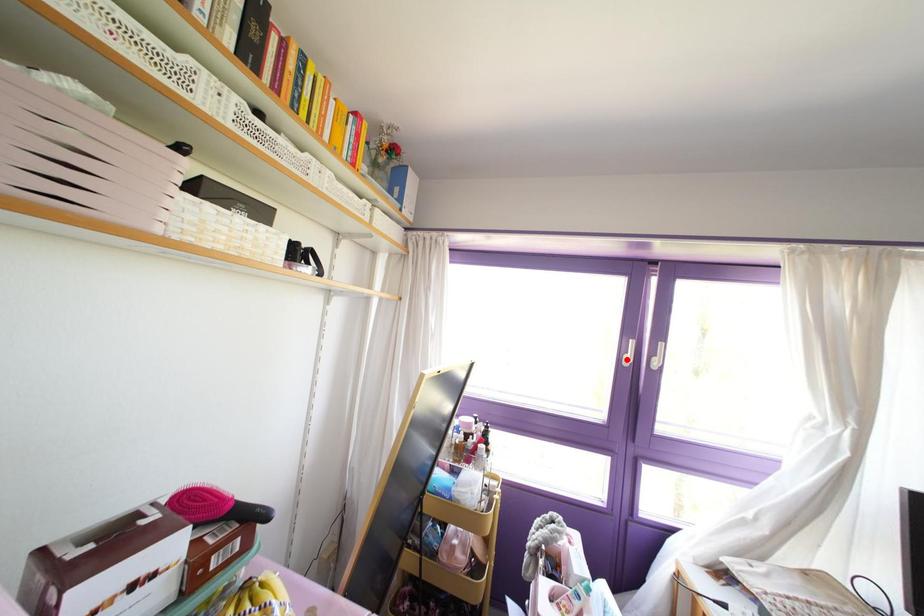
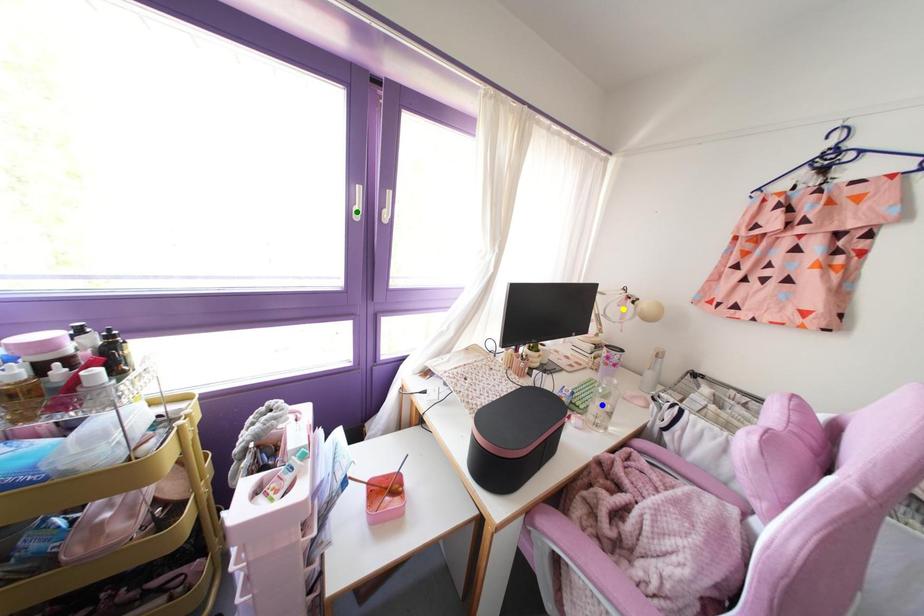
Question: I am providing you with two images of the same scene from different viewpoints. A red point is marked on the first image. You are given multiple points on the second image. Which spot in image 2 lines up with the point in image 1?

Choices:
 (A) blue point
 (B) yellow point
 (C) green point

Answer: (C)